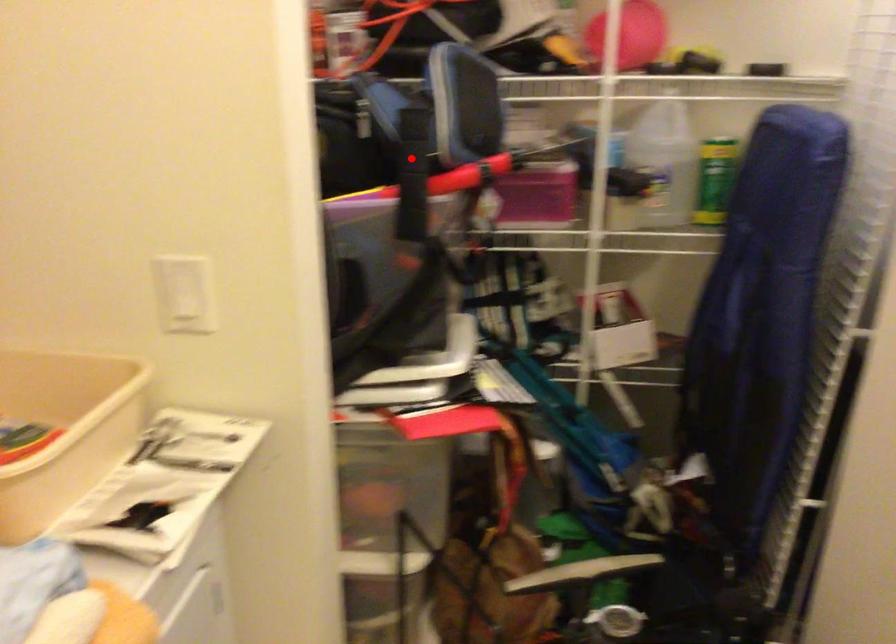
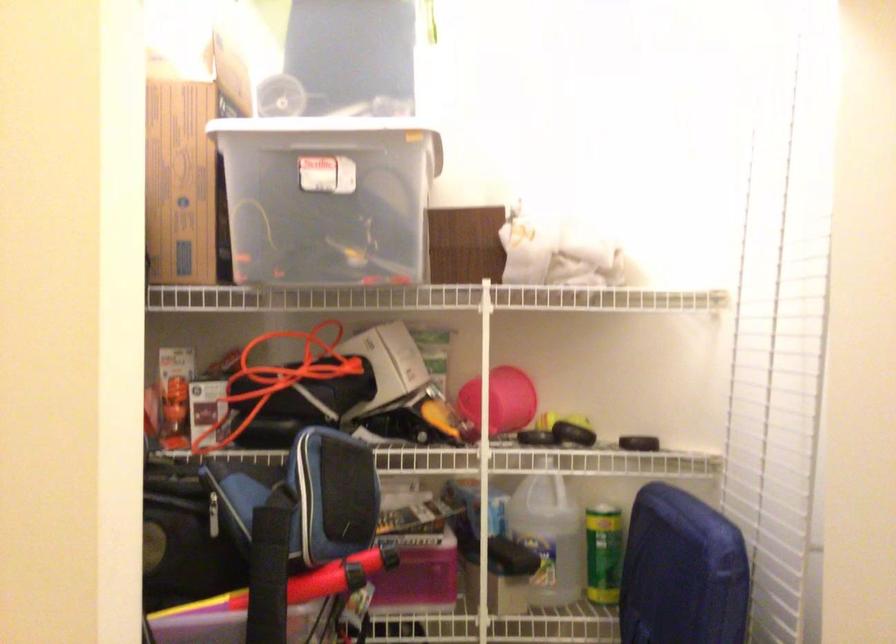
Question: I am providing you with two images of the same scene from different viewpoints. In image1, a red point is highlighted. Considering the same 3D point in image2, which of the following is correct?

Choices:
 (A) It is closer
 (B) It is farther

Answer: (A)